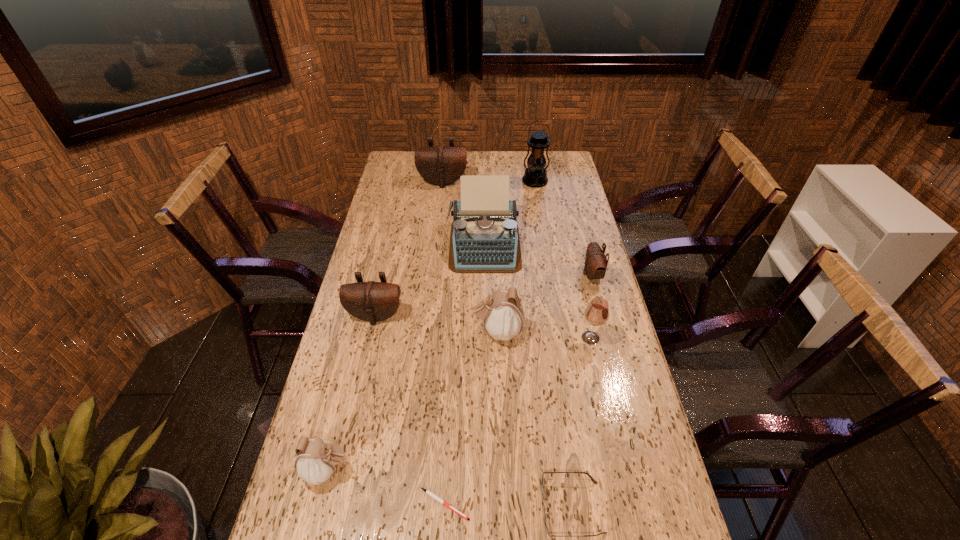
What are the coordinates of `vacant point located between the farthest pouch and the nearest pouch` in the screenshot? It's located at (385, 326).

The height and width of the screenshot is (540, 960). What are the coordinates of `free spot between the shortest object and the nearest pouch` in the screenshot? It's located at (386, 487).

You are a GUI agent. You are given a task and a screenshot of the screen. Output one action in this format:
    pyautogui.click(x=<x>, y=<y>)
    Task: Click on the object that is the fourth nearest to the pen
    
    Given the screenshot: What is the action you would take?
    pyautogui.click(x=371, y=301)

Select which object is the seventh closest to the farthest brown pouch. Please provide its 2D coordinates. Your answer should be formatted as a tuple, i.e. [(x, y)], where the tuple contains the x and y coordinates of a point satisfying the conditions above.

[(316, 460)]

Find the location of `pouch that can be found as the third closest to the wineglass`. pouch that can be found as the third closest to the wineglass is located at coordinates (371, 301).

Locate an element on the screen. pouch that stands as the second closest to the pen is located at coordinates (503, 318).

Where is `the third closest brown pouch to the pen`? The height and width of the screenshot is (540, 960). the third closest brown pouch to the pen is located at coordinates (440, 165).

Choose which brown pouch is the second nearest neighbor to the spectacles. Please provide its 2D coordinates. Your answer should be formatted as a tuple, i.e. [(x, y)], where the tuple contains the x and y coordinates of a point satisfying the conditions above.

[(596, 262)]

Find the location of a particular element. vacant area that satisfies the following two spatial constraints: 1. on the typing side of the wineglass; 2. on the right side of the typewriter is located at coordinates (485, 338).

At what (x,y) coordinates should I click in order to perform the action: click on blank area in the image that satisfies the following two spatial constraints: 1. with the flap open on the wineglass; 2. on the left side of the biggest brown pouch. Please return your answer as a coordinate pair (x, y). The width and height of the screenshot is (960, 540). Looking at the image, I should click on (425, 338).